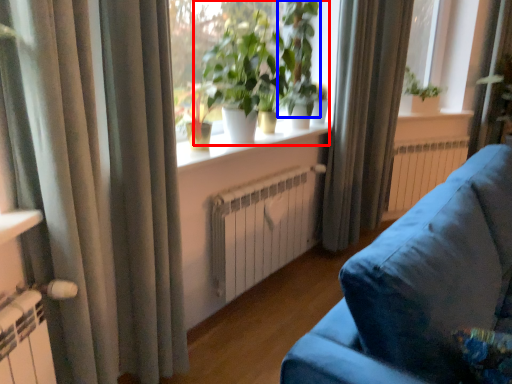
Question: Which object appears closest to the camera in this image, houseplant (highlighted by a red box) or vegetation (highlighted by a blue box)?

Choices:
 (A) houseplant
 (B) vegetation

Answer: (A)